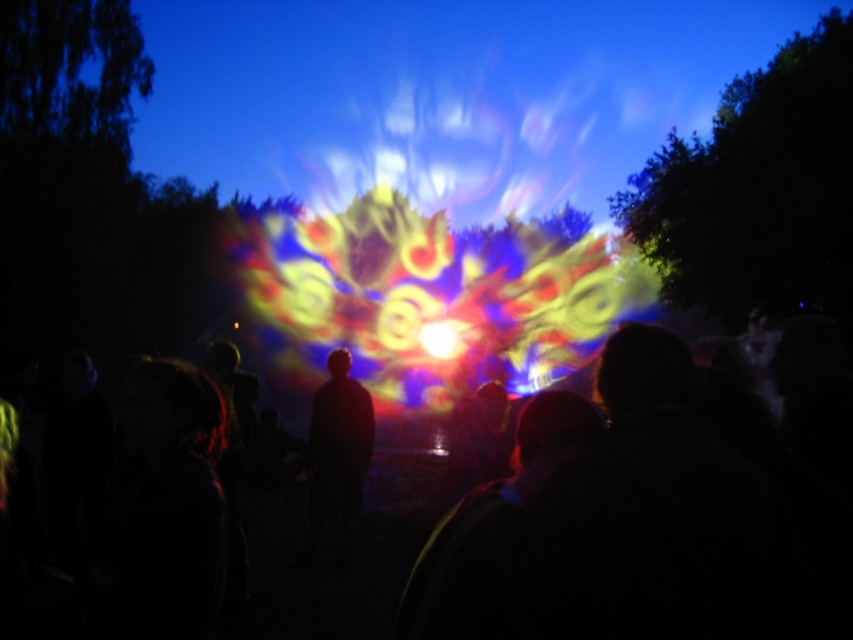
Who is lower down, black matte crowd at center or silhouette figure at center?

Positioned lower is black matte crowd at center.

Between black matte crowd at center and silhouette figure at center, which one appears on the left side from the viewer's perspective?

black matte crowd at center is more to the left.

Image resolution: width=853 pixels, height=640 pixels. Describe the element at coordinates (334, 556) in the screenshot. I see `black matte crowd at center` at that location.

Locate an element on the screen. black matte crowd at center is located at coordinates (334, 556).

Does black matte crowd at center have a greater height compared to bright yellow light at center?

Correct, black matte crowd at center is much taller as bright yellow light at center.

Who is taller, black matte crowd at center or bright yellow light at center?

Standing taller between the two is black matte crowd at center.

Who is more forward, (805, 484) or (428, 332)?

Point (805, 484) is more forward.

Find the location of a particular element. This screenshot has width=853, height=640. black matte crowd at center is located at coordinates (334, 556).

Which is more to the right, silhouette figure at center or bright yellow light at center?

bright yellow light at center is more to the right.

Who is more forward, [340,404] or [442,330]?

Positioned in front is point [340,404].

Identify the location of silhouette figure at center. This screenshot has width=853, height=640. (338, 442).